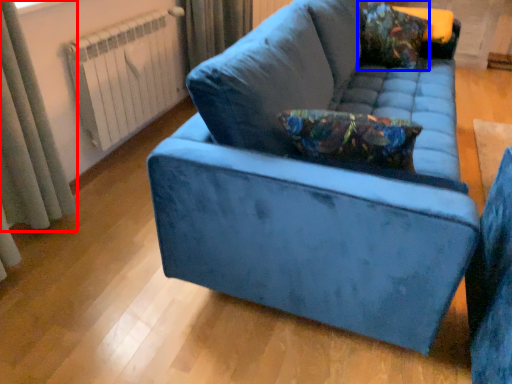
Question: Which object is closer to the camera taking this photo, curtain (highlighted by a red box) or throw pillow (highlighted by a blue box)?

Choices:
 (A) curtain
 (B) throw pillow

Answer: (A)